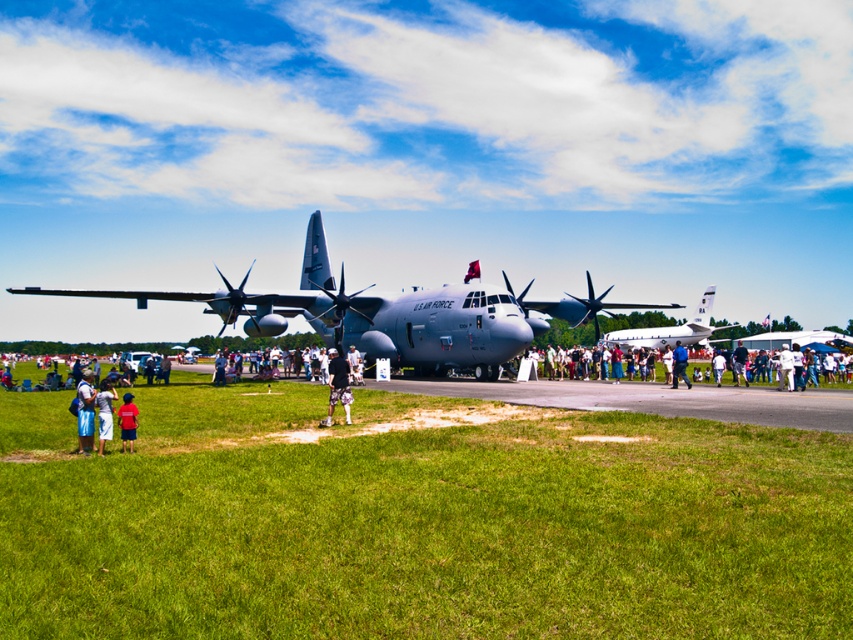
You are a photographer at the airshow and want to capture a clear photo of the U.S. Air Force C130 Hercules aircraft. However, there are two people in the way wearing denim shorts at center and red shirt at center. Which clothing item should you ask to move so that the person is no longer blocking your view of the aircraft?

The denim shorts at center is positioned over red shirt at center. To unblock the view, the denim shorts at center should be moved since it is covering the red shirt at center, which might be closer to the photographer.

You are an event organizer at the airshow and need to arrange a photo shoot. You have two items to place in the center of the scene for a backdrop. The camouflage shorts at center and the red shirt at center must be positioned side by side. Which item should you place on the left to ensure the wider object is on the left side of the photo?

The camouflage shorts at center should be placed on the left side because its width is larger than the red shirt at center, ensuring the wider object is positioned on the left.

You are a photographer standing at the edge of the tarmac at the airshow. You want to take a photo of both the camouflage shorts at center and the red shirt at center so that both are clearly visible. Which object should you focus on first to ensure both are in frame?

The camouflage shorts at center is much taller than the red shirt at center, so you should focus on the camouflage shorts at center first to ensure the entire height of both objects fits within the frame.